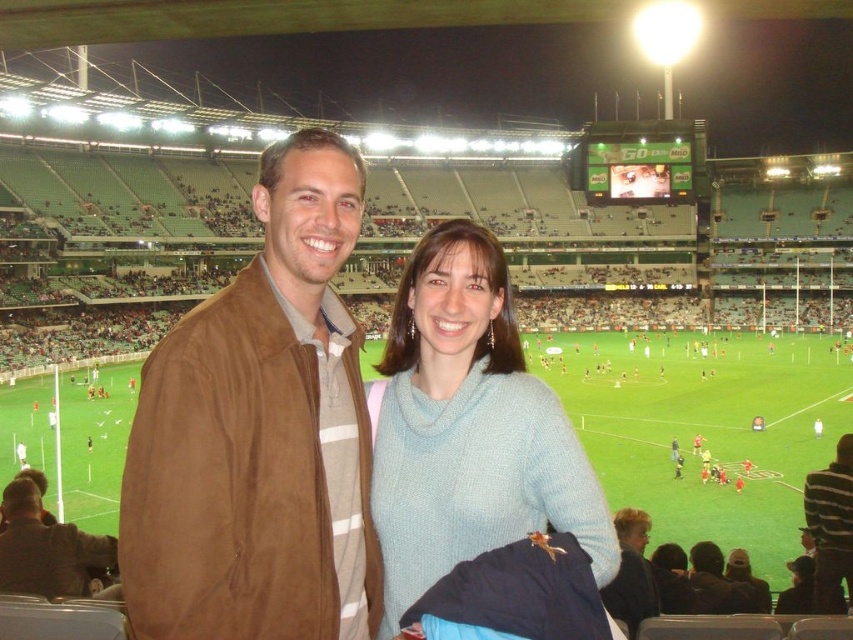
Consider the image. Who is more forward, (236,381) or (393,563)?

Point (236,381) is more forward.

Can you confirm if brown suede jacket at center is wider than light blue sweater at center?

No.

Between point (161, 360) and point (476, 224), which one is positioned behind?

Point (476, 224)

Locate an element on the screen. brown suede jacket at center is located at coordinates (259, 435).

Does brown leather jacket at lower left have a larger size compared to striped sweater at center?

No.

Can you confirm if brown leather jacket at lower left is positioned to the right of striped sweater at center?

Incorrect, brown leather jacket at lower left is not on the right side of striped sweater at center.

Is point (4, 520) positioned in front of point (825, 492)?

Yes, it is in front of point (825, 492).

The image size is (853, 640). I want to click on brown leather jacket at lower left, so click(45, 548).

Is brown suede jacket at center shorter than brown leather jacket at lower left?

No.

Does brown suede jacket at center have a greater height compared to brown leather jacket at lower left?

Yes.

Is point (352, 604) positioned after point (88, 573)?

That is False.

Locate an element on the screen. brown suede jacket at center is located at coordinates (259, 435).